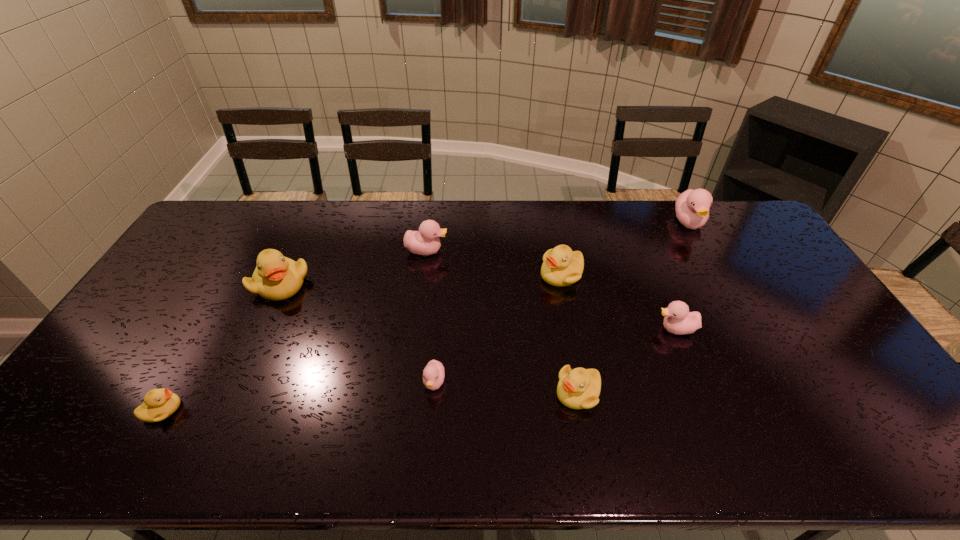
Find the location of `the leftmost yellow duckling`. the leftmost yellow duckling is located at coordinates (159, 404).

Image resolution: width=960 pixels, height=540 pixels. I want to click on the smallest yellow duckling, so click(159, 404).

Locate an element on the screen. free space located on the front-facing side of the rightmost duckling is located at coordinates (722, 281).

I want to click on vacant space located 0.330m on the front-facing side of the biggest yellow duckling, so click(228, 400).

Identify the location of vacant region located on the front-facing side of the third smallest pink duckling. Image resolution: width=960 pixels, height=540 pixels. (x=468, y=251).

What are the coordinates of `vacant region located 0.110m on the front-facing side of the second biggest yellow duckling` in the screenshot? It's located at (506, 274).

At what (x,y) coordinates should I click in order to perform the action: click on free space located on the front-facing side of the second biggest yellow duckling. Please return your answer as a coordinate pair (x, y). The width and height of the screenshot is (960, 540). Looking at the image, I should click on (457, 274).

The width and height of the screenshot is (960, 540). I want to click on free space located 0.300m on the front-facing side of the second biggest yellow duckling, so click(x=447, y=274).

Where is `vacant space located 0.310m on the front-facing side of the second duckling from right to left`? This screenshot has height=540, width=960. vacant space located 0.310m on the front-facing side of the second duckling from right to left is located at coordinates (547, 329).

Where is `vacant space located 0.250m on the front-facing side of the second duckling from right to left`? vacant space located 0.250m on the front-facing side of the second duckling from right to left is located at coordinates (568, 329).